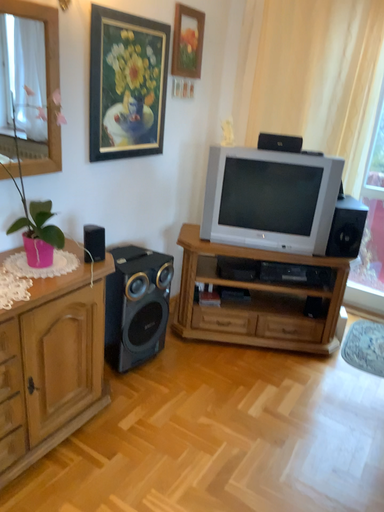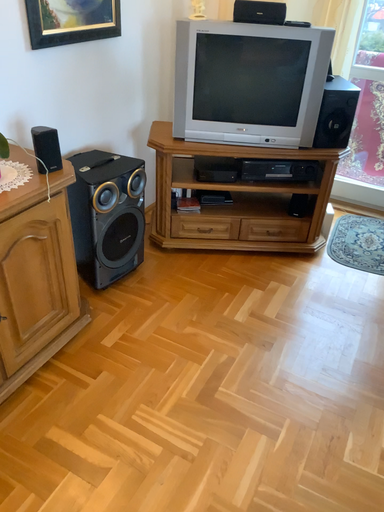
Question: How did the camera likely rotate when shooting the video?

Choices:
 (A) rotated upward
 (B) rotated downward

Answer: (B)